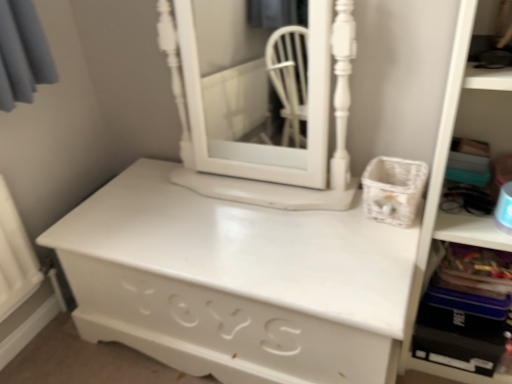
Question: In the image, is white plastic bookshelf at right on the left side or the right side of white painted wood medicine cabinet at center?

Choices:
 (A) right
 (B) left

Answer: (A)

Question: Choose the correct answer: Is white plastic bookshelf at right inside white painted wood medicine cabinet at center or outside it?

Choices:
 (A) outside
 (B) inside

Answer: (A)

Question: Which is farther from the white matte chest of drawers at center?

Choices:
 (A) white painted wood medicine cabinet at center
 (B) white plastic bookshelf at right

Answer: (A)

Question: Considering the real-world distances, which object is closest to the white plastic bookshelf at right?

Choices:
 (A) white painted wood medicine cabinet at center
 (B) white matte chest of drawers at center

Answer: (B)